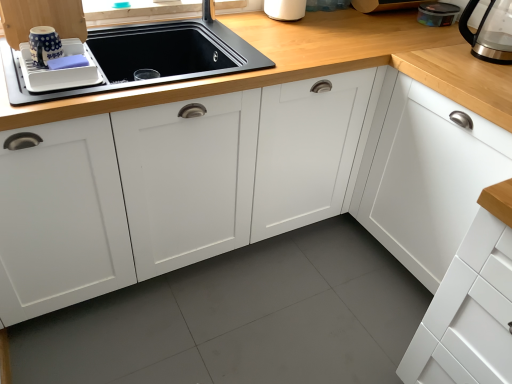
What do you see at coordinates (386, 5) in the screenshot?
I see `wooden cutting board at upper right, marked as the 4th appliance in a front-to-back arrangement` at bounding box center [386, 5].

This screenshot has height=384, width=512. What do you see at coordinates (425, 175) in the screenshot?
I see `white matte cabinet at center-right, the third cabinetry when ordered from left to right` at bounding box center [425, 175].

Measure the distance between point (424, 113) and camera.

A distance of 1.46 meters exists between point (424, 113) and camera.

Find the location of a particular element. The height and width of the screenshot is (384, 512). white glossy cabinet at center, placed as the second cabinetry when sorted from right to left is located at coordinates (169, 187).

What do you see at coordinates (169, 187) in the screenshot? I see `white glossy cabinet at center, placed as the second cabinetry when sorted from right to left` at bounding box center [169, 187].

The image size is (512, 384). I want to click on white glossy tray at upper left, the first cabinetry when ordered from left to right, so click(42, 18).

Considering their positions, is transparent plastic container at upper right, the second appliance viewed from the back, located in front of or behind blue dotted cup at upper left, which is the 2th appliance from front to back?

In the image, transparent plastic container at upper right, the second appliance viewed from the back, appears behind blue dotted cup at upper left, which is the 2th appliance from front to back.

Does transparent plastic container at upper right, which is the third appliance from front to back, have a smaller size compared to blue dotted cup at upper left, which is the third appliance from back to front?

No, transparent plastic container at upper right, which is the third appliance from front to back, is not smaller than blue dotted cup at upper left, which is the third appliance from back to front.

Which is closer, (436,12) or (42,35)?

Clearly, point (436,12) is more distant from the camera than point (42,35).

Which is farther, (45, 66) or (358, 188)?

The point (358, 188) is farther from the camera.

Is blue dotted cup at upper left, positioned as the 3th appliance in right-to-left order, in front of or behind white matte cabinet at center-right, the first cabinetry when ordered from right to left, in the image?

Clearly, blue dotted cup at upper left, positioned as the 3th appliance in right-to-left order, is behind white matte cabinet at center-right, the first cabinetry when ordered from right to left.

From the image's perspective, which object appears higher, blue dotted cup at upper left, which is the 2th appliance from front to back, or white matte cabinet at center-right, the third cabinetry when ordered from left to right?

blue dotted cup at upper left, which is the 2th appliance from front to back, is shown above in the image.

Is wooden cutting board at upper right, marked as the 4th appliance in a front-to-back arrangement, situated inside transparent plastic container at upper right, which is the third appliance from front to back, or outside?

wooden cutting board at upper right, marked as the 4th appliance in a front-to-back arrangement, lies outside transparent plastic container at upper right, which is the third appliance from front to back.

Consider the image. Is there a large distance between wooden cutting board at upper right, acting as the 2th appliance starting from the right, and transparent plastic container at upper right, which is the third appliance from front to back?

No.

Is wooden cutting board at upper right, placed as the 1th appliance when sorted from back to front, to the left or to the right of transparent plastic container at upper right, which is the third appliance from front to back, in the image?

wooden cutting board at upper right, placed as the 1th appliance when sorted from back to front, is positioned on transparent plastic container at upper right, which is the third appliance from front to back,'s left side.

Is point (365, 9) positioned before point (426, 25)?

No, it is behind (426, 25).

From a real-world perspective, which object stands above the other?

From a 3D spatial view, blue dotted cup at upper left, positioned as the 3th appliance in right-to-left order, is above.

Is blue dotted cup at upper left, the second appliance in the left-to-right sequence, wider than wooden cutting board at upper right, placed as the 1th appliance when sorted from back to front?

No.

In the scene shown: Considering the sizes of objects blue dotted cup at upper left, which is the 2th appliance from front to back, and wooden cutting board at upper right, acting as the 2th appliance starting from the right, in the image provided, who is shorter, blue dotted cup at upper left, which is the 2th appliance from front to back, or wooden cutting board at upper right, acting as the 2th appliance starting from the right,?

blue dotted cup at upper left, which is the 2th appliance from front to back.

How different are the orientations of blue dotted cup at upper left, which is the third appliance from back to front, and wooden cutting board at upper right, acting as the 2th appliance starting from the right, in degrees?

They differ by 1.84 degrees in their facing directions.

Which is behind, point (508, 11) or point (407, 4)?

The point (407, 4) is farther.

From the picture: From the image's perspective, is transparent glass coffeepot at upper right positioned above or below wooden cutting board at upper right, placed as the 1th appliance when sorted from back to front?

Based on their image positions, transparent glass coffeepot at upper right is located beneath wooden cutting board at upper right, placed as the 1th appliance when sorted from back to front.

Looking at the image, does transparent glass coffeepot at upper right seem bigger or smaller compared to wooden cutting board at upper right, acting as the 2th appliance starting from the right?

In the image, transparent glass coffeepot at upper right appears to be larger than wooden cutting board at upper right, acting as the 2th appliance starting from the right.

This screenshot has width=512, height=384. In order to click on coffeepot on the right side of wooden cutting board at upper right, marked as the 4th appliance in a front-to-back arrangement in this screenshot , I will do `click(490, 31)`.

Based on the photo, between transparent glass coffeepot at upper right and transparent plastic container at upper right, which is the third appliance from front to back, which one appears on the left side from the viewer's perspective?

transparent plastic container at upper right, which is the third appliance from front to back, is more to the left.

Looking at their sizes, would you say transparent glass coffeepot at upper right is wider or thinner than transparent plastic container at upper right, the second appliance viewed from the back?

transparent glass coffeepot at upper right is wider than transparent plastic container at upper right, the second appliance viewed from the back.

What are the coordinates of `coffeepot that appears on the right of transparent plastic container at upper right, which is the third appliance from front to back` in the screenshot? It's located at (490, 31).

Is transparent glass coffeepot at upper right positioned far away from transparent plastic container at upper right, the fourth appliance when ordered from left to right?

Actually, transparent glass coffeepot at upper right and transparent plastic container at upper right, the fourth appliance when ordered from left to right, are a little close together.

Is blue dotted cup at upper left, the second appliance in the left-to-right sequence, facing away from white glossy cabinet at center, placed as the second cabinetry when sorted from right to left?

blue dotted cup at upper left, the second appliance in the left-to-right sequence, is not turned away from white glossy cabinet at center, placed as the second cabinetry when sorted from right to left.

From their relative heights in the image, would you say blue dotted cup at upper left, positioned as the 3th appliance in right-to-left order, is taller or shorter than white glossy cabinet at center, placed as the second cabinetry when sorted from right to left?

Clearly, blue dotted cup at upper left, positioned as the 3th appliance in right-to-left order, is shorter compared to white glossy cabinet at center, placed as the second cabinetry when sorted from right to left.

Is point (35, 55) behind point (260, 233)?

No.

Can you confirm if blue dotted cup at upper left, which is the third appliance from back to front, is bigger than white glossy cabinet at center, placed as the second cabinetry when sorted from right to left?

No, blue dotted cup at upper left, which is the third appliance from back to front, is not bigger than white glossy cabinet at center, placed as the second cabinetry when sorted from right to left.

Locate an element on the screen. the 2nd appliance located above the transparent plastic container at upper right, which ranks as the first appliance in right-to-left order (from a real-world perspective) is located at coordinates (44, 45).

You are a GUI agent. You are given a task and a screenshot of the screen. Output one action in this format:
    pyautogui.click(x=<x>, y=<y>)
    Task: Click on the 3rd appliance to the left when counting from the white matte cabinet at center-right, the first cabinetry when ordered from right to left
    
    Given the screenshot: What is the action you would take?
    pyautogui.click(x=44, y=45)

Considering their positions, is wooden cutting board at upper right, placed as the 1th appliance when sorted from back to front, positioned further to blue dotted cup at upper left, the second appliance in the left-to-right sequence, than white glossy tray at upper left, which is the third cabinetry in right-to-left order?

The object further to blue dotted cup at upper left, the second appliance in the left-to-right sequence, is wooden cutting board at upper right, placed as the 1th appliance when sorted from back to front.

Looking at the image, which one is located further to transparent plastic container at upper right, which ranks as the first appliance in right-to-left order, white glossy cabinet at center, placed as the second cabinetry when sorted from right to left, or white glossy tray at upper left, which is the third cabinetry in right-to-left order?

Based on the image, white glossy tray at upper left, which is the third cabinetry in right-to-left order, appears to be further to transparent plastic container at upper right, which ranks as the first appliance in right-to-left order.

When comparing their distances from transparent plastic container at upper right, which ranks as the first appliance in right-to-left order, does white glossy tray at upper left, which is the third cabinetry in right-to-left order, or white matte cabinet at center-right, the third cabinetry when ordered from left to right, seem closer?

white matte cabinet at center-right, the third cabinetry when ordered from left to right, is positioned closer to the anchor transparent plastic container at upper right, which ranks as the first appliance in right-to-left order.

Looking at the image, which one is located further to white glossy tray at upper left, which is the third cabinetry in right-to-left order, transparent glass coffeepot at upper right or white matte cabinet at center-right, the first cabinetry when ordered from right to left?

The object further to white glossy tray at upper left, which is the third cabinetry in right-to-left order, is transparent glass coffeepot at upper right.

Based on the photo, estimate the real-world distances between objects in this image. Which object is closer to white glossy cabinet at center, which is the second cabinetry from left to right, white glossy tray at upper left, the first cabinetry when ordered from left to right, or white matte cabinet at center-right, the third cabinetry when ordered from left to right?

white matte cabinet at center-right, the third cabinetry when ordered from left to right, lies closer to white glossy cabinet at center, which is the second cabinetry from left to right, than the other object.

Considering their positions, is transparent plastic container at upper right, which is the third appliance from front to back, positioned further to white glossy cabinet at center, which is the second cabinetry from left to right, than white plastic dish drainer at upper left, which is the 4th appliance from right to left?

transparent plastic container at upper right, which is the third appliance from front to back.

From the image, which object appears to be nearer to white matte cabinet at center-right, the third cabinetry when ordered from left to right, white glossy cabinet at center, placed as the second cabinetry when sorted from right to left, or transparent glass coffeepot at upper right?

transparent glass coffeepot at upper right lies closer to white matte cabinet at center-right, the third cabinetry when ordered from left to right, than the other object.

Based on their spatial positions, is white glossy cabinet at center, which is the second cabinetry from left to right, or blue dotted cup at upper left, the second appliance in the left-to-right sequence, closer to transparent plastic container at upper right, the second appliance viewed from the back?

white glossy cabinet at center, which is the second cabinetry from left to right, lies closer to transparent plastic container at upper right, the second appliance viewed from the back, than the other object.

Locate an element on the screen. cabinetry situated between white plastic dish drainer at upper left, the first appliance viewed from the left, and white matte cabinet at center-right, the first cabinetry when ordered from right to left, from left to right is located at coordinates (169, 187).

Identify the location of appliance located between white plastic dish drainer at upper left, the 4th appliance from the back, and white glossy cabinet at center, placed as the second cabinetry when sorted from right to left, in the left-right direction. (44, 45).

The width and height of the screenshot is (512, 384). In order to click on cabinetry between white glossy tray at upper left, which is the third cabinetry in right-to-left order, and white matte cabinet at center-right, the third cabinetry when ordered from left to right in this screenshot , I will do `click(169, 187)`.

Find the location of a particular element. The image size is (512, 384). cabinetry between white glossy tray at upper left, which is the third cabinetry in right-to-left order, and wooden cutting board at upper right, acting as the 2th appliance starting from the right, in the horizontal direction is located at coordinates (169, 187).